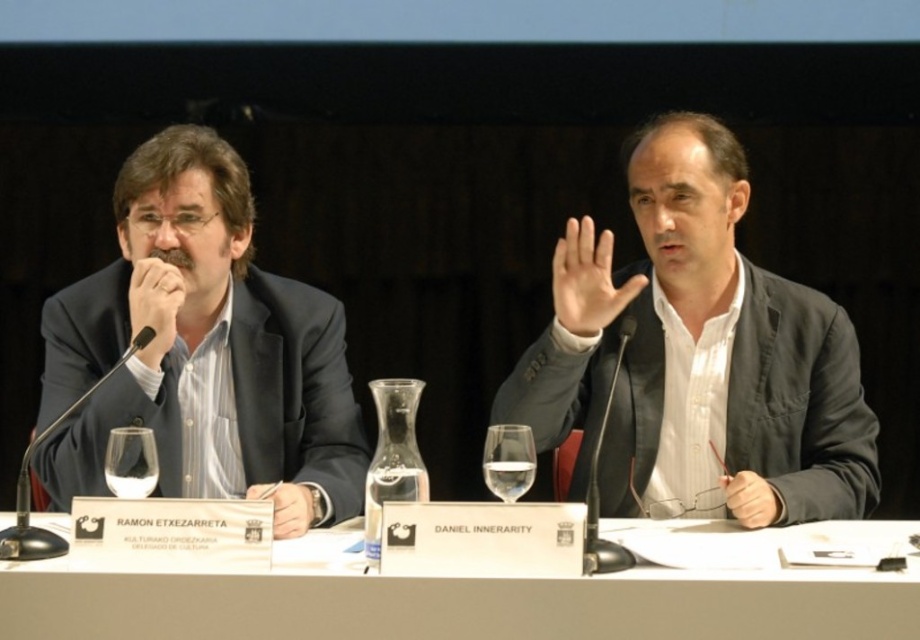
You are a waiter at a formal event and need to place a 18 inch long platter between the matte black suit at left and the clear glass wine glass at center. Can you fit the platter between them without moving either object?

The distance between the matte black suit at left and the clear glass wine glass at center is 19.15 inches. Since the platter is 18 inches long, it can fit within the available space.

You are a photographer trying to capture a closeup of both the matte black hand at center and the white matte hand at center during a professional event. Since you want both hands to appear the same size in the photo, which hand should you move closer to the camera and which should you move farther away?

The matte black hand at center is much taller than the white matte hand at center. To make them appear the same size in the photo, move the white matte hand at center closer to the camera and the matte black hand at center farther away.